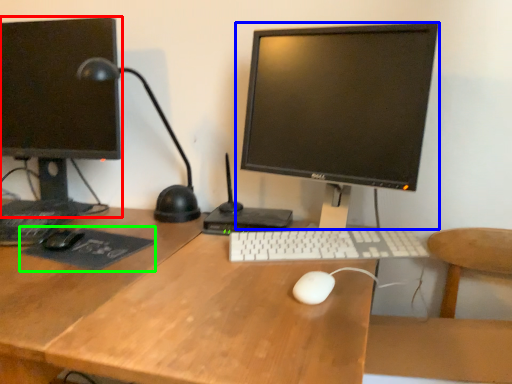
Question: Which object is the farthest from computer monitor (highlighted by a red box)? Choose among these: computer monitor (highlighted by a blue box) or mousepad (highlighted by a green box).

Choices:
 (A) computer monitor
 (B) mousepad

Answer: (A)